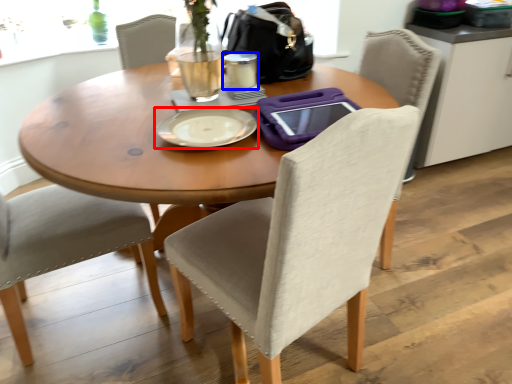
Question: Which object appears farthest to the camera in this image, plate (highlighted by a red box) or coffee cup (highlighted by a blue box)?

Choices:
 (A) plate
 (B) coffee cup

Answer: (B)